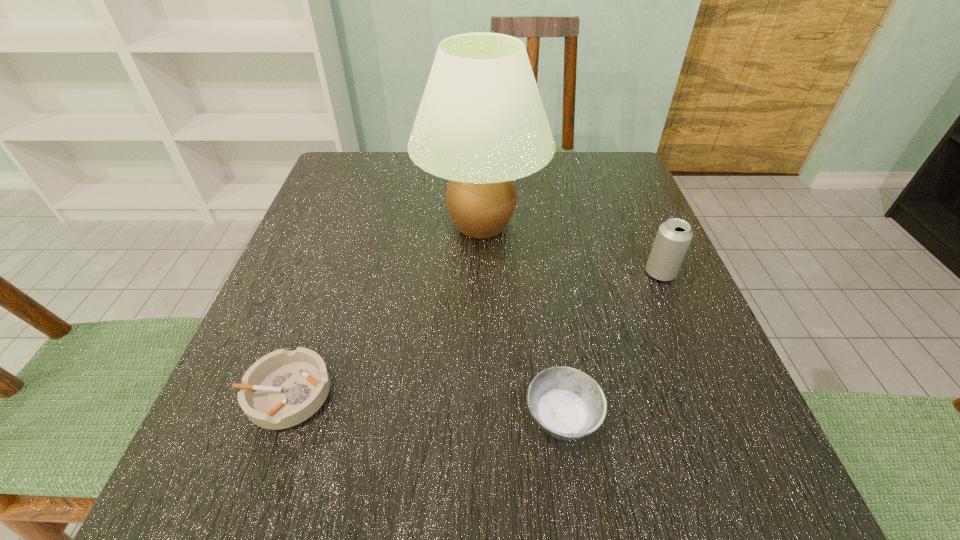
Locate an element on the screen. The width and height of the screenshot is (960, 540). empty space that is in between the second shortest object and the shortest object is located at coordinates (424, 405).

Find the location of a particular element. The image size is (960, 540). vacant point located between the right ashtray and the shorter ashtray is located at coordinates (424, 405).

This screenshot has width=960, height=540. What are the coordinates of `object that can be found as the closest to the taller ashtray` in the screenshot? It's located at (481, 123).

This screenshot has height=540, width=960. Identify the location of object that is the third closest one to the shorter ashtray. (673, 238).

This screenshot has height=540, width=960. I want to click on free point that satisfies the following two spatial constraints: 1. on the shade of the lampshade; 2. on the right side of the taller ashtray, so click(x=482, y=417).

This screenshot has width=960, height=540. I want to click on free spot that satisfies the following two spatial constraints: 1. on the back side of the third shortest object; 2. on the right side of the left ashtray, so [x=329, y=273].

Where is `vacant space that satisfies the following two spatial constraints: 1. on the shade of the tallest object; 2. on the left side of the third tallest object`? Image resolution: width=960 pixels, height=540 pixels. vacant space that satisfies the following two spatial constraints: 1. on the shade of the tallest object; 2. on the left side of the third tallest object is located at coordinates tap(482, 417).

This screenshot has height=540, width=960. I want to click on free location that satisfies the following two spatial constraints: 1. on the shade of the lampshade; 2. on the front side of the left ashtray, so click(x=482, y=393).

Find the location of a particular element. blank space that satisfies the following two spatial constraints: 1. on the shade of the lampshade; 2. on the left side of the rightmost object is located at coordinates 481,273.

Where is `free space that satisfies the following two spatial constraints: 1. on the shade of the right ashtray; 2. on the left side of the lampshade`? This screenshot has height=540, width=960. free space that satisfies the following two spatial constraints: 1. on the shade of the right ashtray; 2. on the left side of the lampshade is located at coordinates (482, 417).